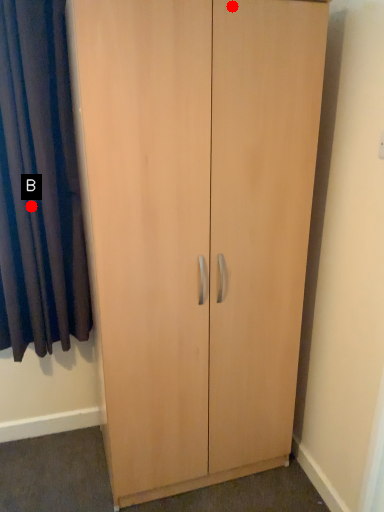
Question: Two points are circled on the image, labeled by A and B beside each circle. Which point is closer to the camera taking this photo?

Choices:
 (A) A is closer
 (B) B is closer

Answer: (A)